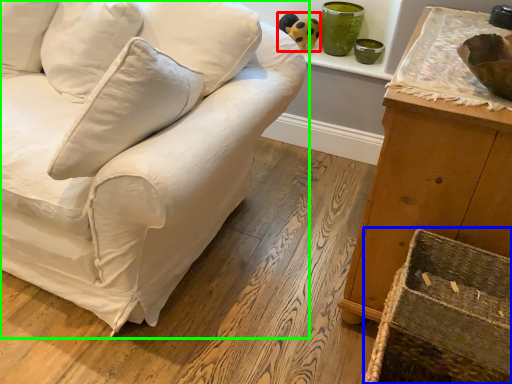
Question: Which object is positioned closest to toy (highlighted by a red box)? Select from crate (highlighted by a blue box) and studio couch (highlighted by a green box).

Choices:
 (A) crate
 (B) studio couch

Answer: (B)